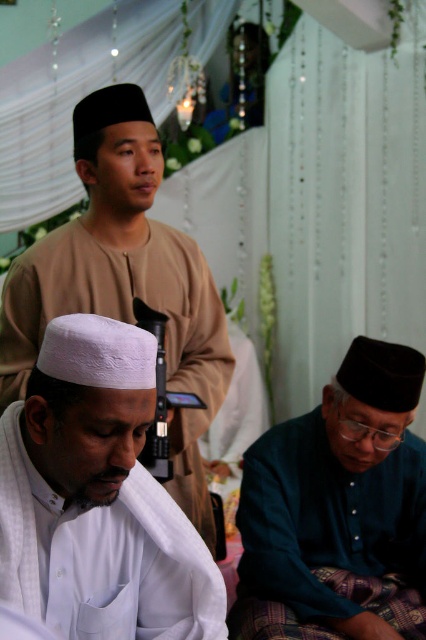
Is point (26, 518) positioned in front of point (342, 621)?

Yes.

Who is more forward, (149, 540) or (393, 484)?

Point (149, 540)

Where is `white matte cap at center`? white matte cap at center is located at coordinates (97, 497).

Can you confirm if dark blue fabric at lower right is smaller than matte beige robe at center?

Indeed, dark blue fabric at lower right has a smaller size compared to matte beige robe at center.

From the picture: Can you confirm if dark blue fabric at lower right is positioned below matte beige robe at center?

Result: Yes.

Who is more distant from viewer, (333,440) or (115,260)?

Positioned behind is point (333,440).

Locate an element on the screen. This screenshot has width=426, height=640. dark blue fabric at lower right is located at coordinates (339, 509).

Can you confirm if white matte cap at center is bigger than matte beige robe at center?

No.

Is white matte cap at center positioned in front of matte beige robe at center?

Yes, white matte cap at center is in front of matte beige robe at center.

Between point (123, 592) and point (91, 243), which one is positioned behind?

Point (91, 243)

This screenshot has width=426, height=640. What are the coordinates of `white matte cap at center` in the screenshot? It's located at (97, 497).